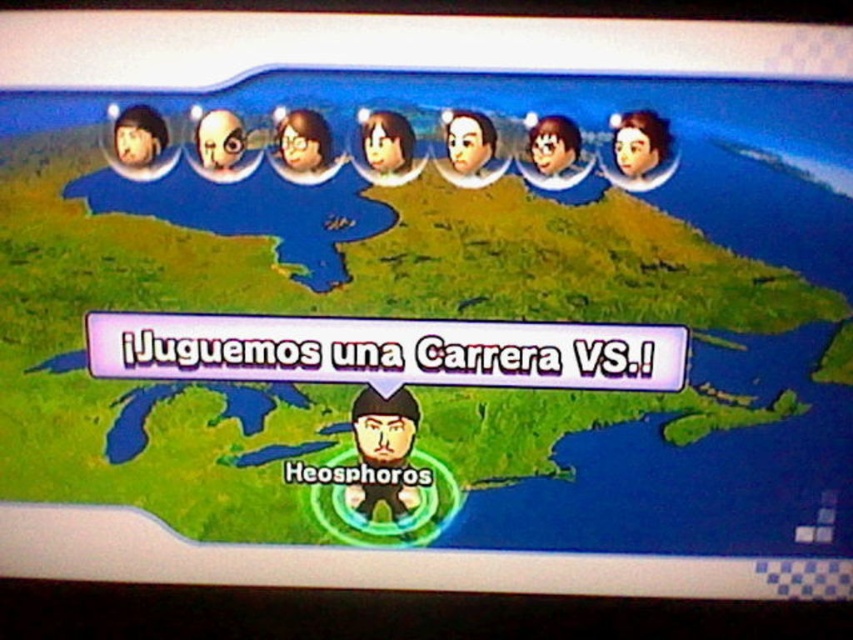
Is matte black head at upper center to the left of matte brown hair at center from the viewer's perspective?

Correct, you'll find matte black head at upper center to the left of matte brown hair at center.

Can you confirm if matte black head at upper center is thinner than matte brown hair at center?

Indeed, matte black head at upper center has a lesser width compared to matte brown hair at center.

What are the coordinates of `matte black head at upper center` in the screenshot? It's located at (469, 141).

This screenshot has width=853, height=640. In order to click on matte black head at upper center in this screenshot , I will do `click(469, 141)`.

This screenshot has height=640, width=853. What do you see at coordinates (641, 144) in the screenshot?
I see `matte black avatar at upper center` at bounding box center [641, 144].

Between point (614, 128) and point (305, 166), which one is positioned behind?

Positioned behind is point (305, 166).

The image size is (853, 640). In order to click on matte black avatar at upper center in this screenshot , I will do `click(641, 144)`.

Who is positioned more to the left, smooth brown hair at center or shiny metallic helmet at upper left?

shiny metallic helmet at upper left is more to the left.

Identify the location of smooth brown hair at center. Image resolution: width=853 pixels, height=640 pixels. (387, 141).